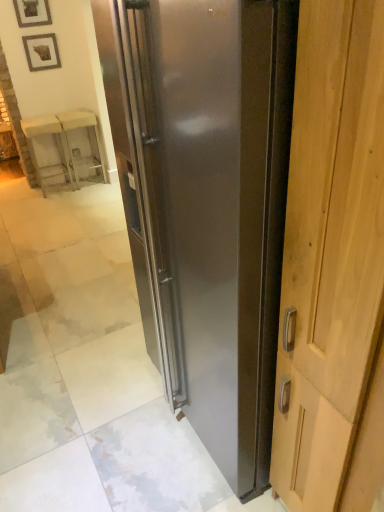
Question: Can you confirm if translucent glass cabinet at upper left, the 1th furniture when ordered from right to left, is smaller than wooden picture frame at upper left, arranged as the first picture frame when ordered from the bottom?

Choices:
 (A) no
 (B) yes

Answer: (A)

Question: Is translucent glass cabinet at upper left, the 1th furniture when ordered from right to left, placed right next to wooden picture frame at upper left, positioned as the 2th picture frame in top-to-bottom order?

Choices:
 (A) yes
 (B) no

Answer: (B)

Question: Is translucent glass cabinet at upper left, the 2th furniture viewed from the left, aimed at wooden picture frame at upper left, positioned as the 2th picture frame in top-to-bottom order?

Choices:
 (A) no
 (B) yes

Answer: (A)

Question: From a real-world perspective, is translucent glass cabinet at upper left, the 2th furniture viewed from the left, positioned over wooden picture frame at upper left, positioned as the 2th picture frame in top-to-bottom order, based on gravity?

Choices:
 (A) no
 (B) yes

Answer: (A)

Question: Does translucent glass cabinet at upper left, the 2th furniture viewed from the left, have a greater height compared to wooden picture frame at upper left, positioned as the 2th picture frame in top-to-bottom order?

Choices:
 (A) yes
 (B) no

Answer: (A)

Question: Is translucent glass cabinet at upper left, the 2th furniture viewed from the left, positioned far away from wooden picture frame at upper left, arranged as the first picture frame when ordered from the bottom?

Choices:
 (A) yes
 (B) no

Answer: (B)

Question: From a real-world perspective, is wooden picture frame at upper left, positioned as the 2th picture frame in top-to-bottom order, positioned over translucent glass cabinet at upper left, the 2th furniture viewed from the left, based on gravity?

Choices:
 (A) no
 (B) yes

Answer: (B)

Question: Could translucent glass cabinet at upper left, the 1th furniture when ordered from right to left, be considered to be inside wooden picture frame at upper left, arranged as the first picture frame when ordered from the bottom?

Choices:
 (A) yes
 (B) no

Answer: (B)

Question: From the image's perspective, is wooden picture frame at upper left, arranged as the first picture frame when ordered from the bottom, above translucent glass cabinet at upper left, the 1th furniture when ordered from right to left?

Choices:
 (A) yes
 (B) no

Answer: (A)

Question: Is wooden picture frame at upper left, positioned as the 2th picture frame in top-to-bottom order, at the left side of translucent glass cabinet at upper left, the 2th furniture viewed from the left?

Choices:
 (A) yes
 (B) no

Answer: (A)

Question: Is wooden picture frame at upper left, arranged as the first picture frame when ordered from the bottom, outside translucent glass cabinet at upper left, the 2th furniture viewed from the left?

Choices:
 (A) yes
 (B) no

Answer: (A)

Question: Considering the relative sizes of wooden picture frame at upper left, arranged as the first picture frame when ordered from the bottom, and translucent glass cabinet at upper left, the 2th furniture viewed from the left, in the image provided, is wooden picture frame at upper left, arranged as the first picture frame when ordered from the bottom, wider than translucent glass cabinet at upper left, the 2th furniture viewed from the left,?

Choices:
 (A) no
 (B) yes

Answer: (A)

Question: Is wooden framed picture at upper left, which appears as the first picture frame when viewed from the top, taller than wooden chair at left, the second furniture viewed from the right?

Choices:
 (A) no
 (B) yes

Answer: (A)